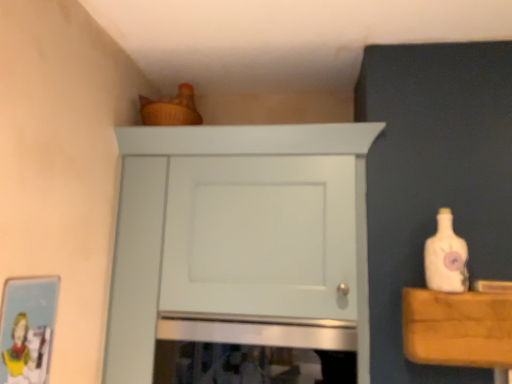
Question: Considering their positions, is white matte bottle at right located in front of or behind white matte cabinet at upper center?

Choices:
 (A) behind
 (B) front

Answer: (B)

Question: Considering the positions of white matte bottle at right and white matte cabinet at upper center in the image, is white matte bottle at right bigger or smaller than white matte cabinet at upper center?

Choices:
 (A) small
 (B) big

Answer: (A)

Question: Estimate the real-world distances between objects in this image. Which object is closer to the white matte bottle at right?

Choices:
 (A) white matte cabinet at upper center
 (B) matte cardboard picture frame at lower left

Answer: (A)

Question: Estimate the real-world distances between objects in this image. Which object is farther from the white matte bottle at right?

Choices:
 (A) white matte cabinet at upper center
 (B) matte cardboard picture frame at lower left

Answer: (B)